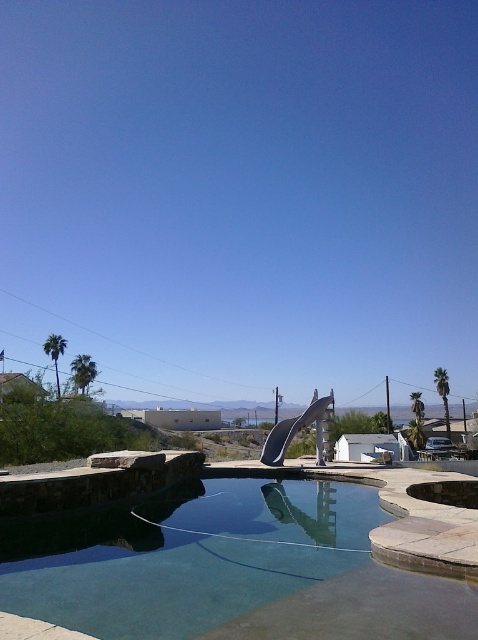
You are planning to install a new lighting system around the clear glass pool at center and the metallic silver slide at center. Since you want to ensure proper coverage, you need to know which object requires more lights. Based on their sizes, which object should have more lights allocated?

The metallic silver slide at center requires more lights because it is larger than the clear glass pool at center.

You are a lifeguard standing on the deck near the clear glass pool at center and the metallic silver slide at center. You need to retrieve a floating toy that fell into the water. Which object is closer to the water surface where the toy would be floating?

The clear glass pool at center is above the metallic silver slide at center, so the toy would be floating on the surface of the clear glass pool at center, making it the closer object to the water surface.